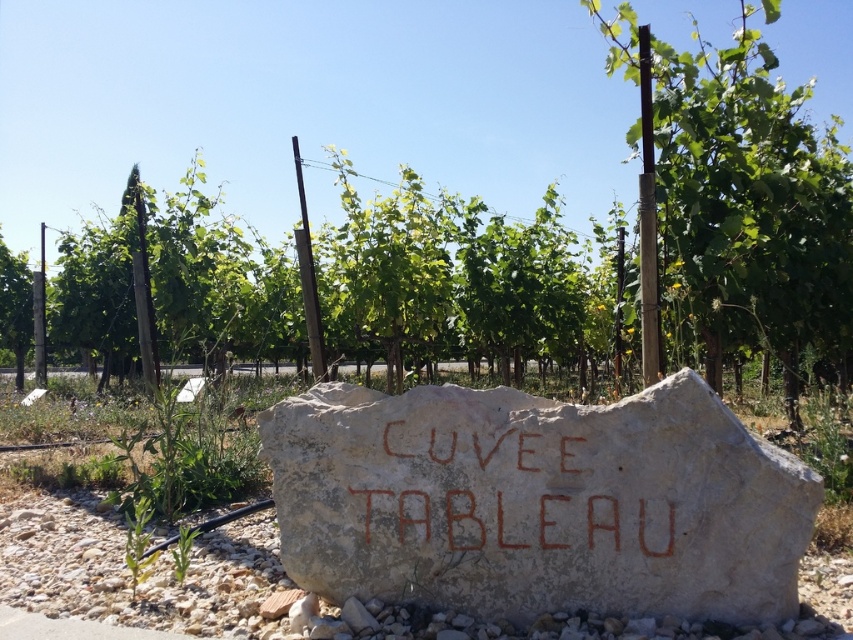
I want to click on white stone boulder at center, so click(x=538, y=500).

Is white stone boulder at center to the right of green leafy tree at center from the viewer's perspective?

No, white stone boulder at center is not to the right of green leafy tree at center.

Who is more distant from viewer, [648,544] or [700,240]?

Positioned behind is point [700,240].

This screenshot has width=853, height=640. In order to click on white stone boulder at center in this screenshot , I will do `click(538, 500)`.

Can you confirm if green leafy tree at center is positioned below brown carved stone at center?

No, green leafy tree at center is not below brown carved stone at center.

Is point (741, 20) farther from camera compared to point (567, 480)?

Yes, it is.

Locate an element on the screen. This screenshot has width=853, height=640. green leafy tree at center is located at coordinates (743, 195).

Identify the location of green leafy tree at center. (743, 195).

Where is `white stone boulder at center`? The width and height of the screenshot is (853, 640). white stone boulder at center is located at coordinates (538, 500).

You are a GUI agent. You are given a task and a screenshot of the screen. Output one action in this format:
    pyautogui.click(x=<x>, y=<y>)
    Task: Click on the white stone boulder at center
    
    Given the screenshot: What is the action you would take?
    [x=538, y=500]

Locate an element on the screen. The width and height of the screenshot is (853, 640). white stone boulder at center is located at coordinates (538, 500).